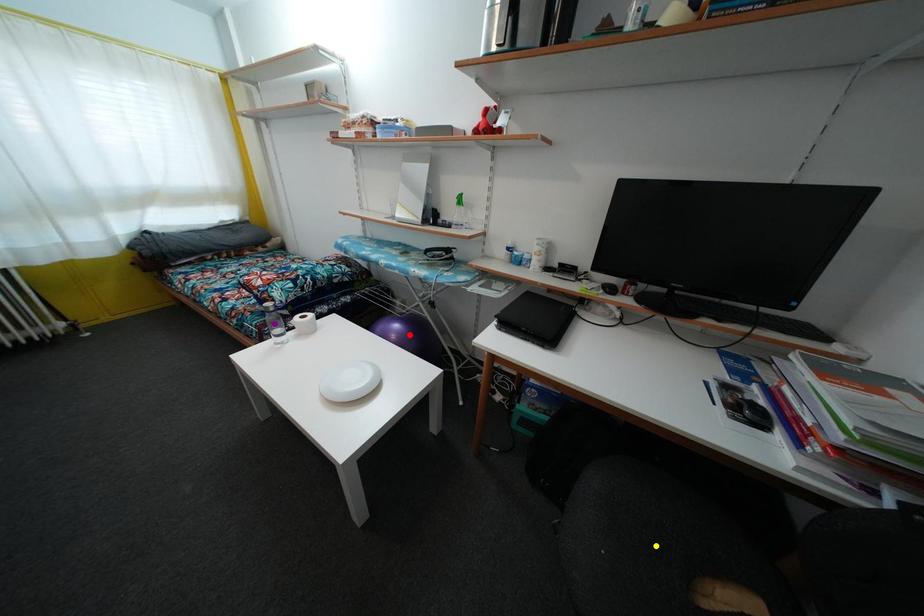
Order these from nearest to farthest:
yellow point, red point, purple point

yellow point < purple point < red point